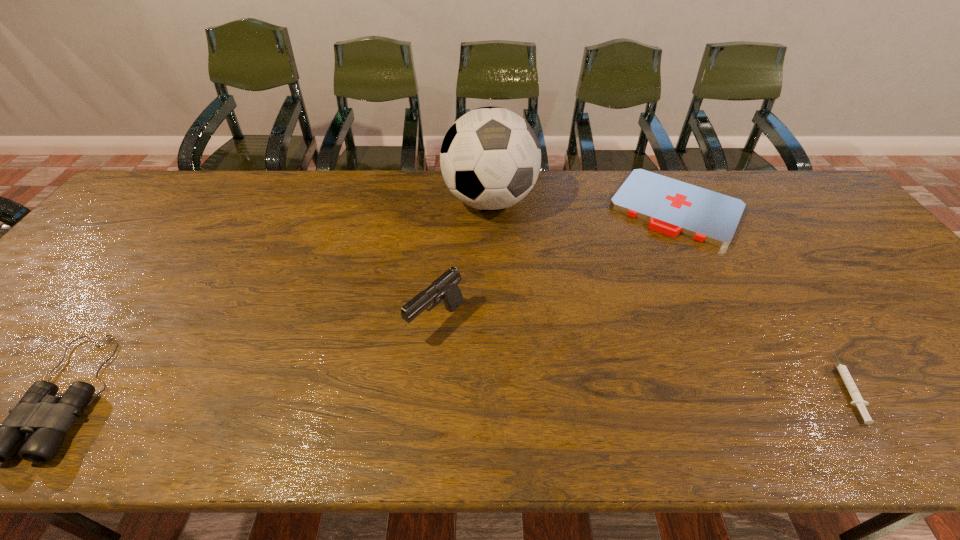
Identify the location of blank space located on handle side the first-aid kit. The height and width of the screenshot is (540, 960). (615, 305).

Identify the location of vacant space located 0.060m on the main logo of the soccer ball. (497, 245).

Find the location of a particular element. The width and height of the screenshot is (960, 540). free location located on the main logo of the soccer ball is located at coordinates (502, 273).

At what (x,y) coordinates should I click in order to perform the action: click on blank area located 0.060m on the main logo of the soccer ball. Please return your answer as a coordinate pair (x, y). This screenshot has height=540, width=960. Looking at the image, I should click on (497, 245).

The width and height of the screenshot is (960, 540). I want to click on the first-aid kit located at the far edge, so [671, 207].

Find the location of a particular element. The image size is (960, 540). soccer ball present at the far edge is located at coordinates (490, 158).

Find the location of `object present at the near edge`. object present at the near edge is located at coordinates (858, 401).

This screenshot has height=540, width=960. In order to click on vacant space at the far edge in this screenshot , I will do `click(364, 204)`.

Where is `free spot at the near edge of the desktop`? This screenshot has height=540, width=960. free spot at the near edge of the desktop is located at coordinates (510, 379).

Identify the location of blank space at the left edge of the desktop. The image size is (960, 540). (117, 227).